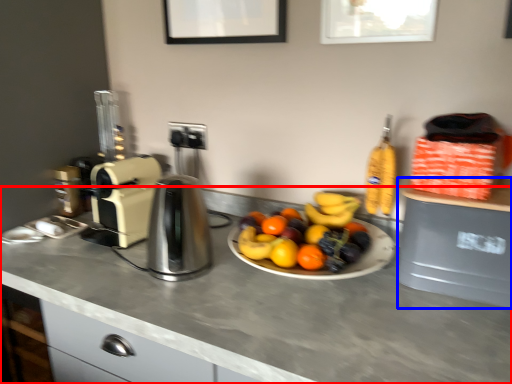
Question: Which point is further to the camera, countertop (highlighted by a red box) or appliance (highlighted by a blue box)?

Choices:
 (A) countertop
 (B) appliance

Answer: (B)